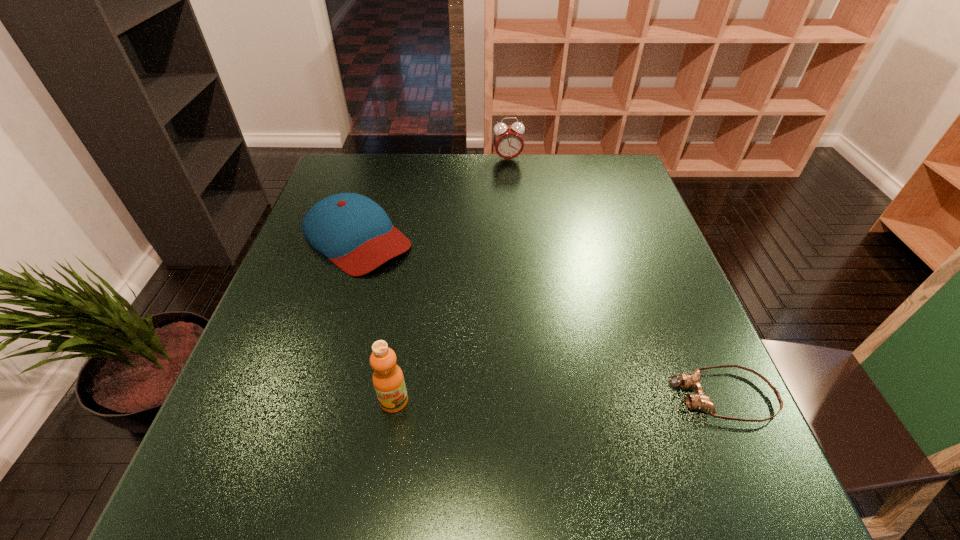
In order to click on vacant area located 0.380m on the clock face of the farthest object in this screenshot , I will do `click(530, 241)`.

Find the location of `vacant area located on the clock face of the farthest object`. vacant area located on the clock face of the farthest object is located at coordinates (520, 202).

In order to click on free space located 0.060m on the clock face of the farthest object in this screenshot , I will do `click(513, 174)`.

Find the location of a particular element. This screenshot has height=540, width=960. free space located 0.250m with the bill of the second farthest object facing forward is located at coordinates (460, 325).

Locate an element on the screen. The height and width of the screenshot is (540, 960). free region located with the bill of the second farthest object facing forward is located at coordinates (419, 290).

You are a GUI agent. You are given a task and a screenshot of the screen. Output one action in this format:
    pyautogui.click(x=<x>, y=<y>)
    Task: Click on the free space located with the bill of the second farthest object facing forward
    The image size is (960, 540).
    Given the screenshot: What is the action you would take?
    pyautogui.click(x=486, y=347)

The height and width of the screenshot is (540, 960). Find the location of `object that is at the far edge`. object that is at the far edge is located at coordinates (508, 141).

This screenshot has height=540, width=960. Identify the location of orange juice at the near edge. (388, 380).

Locate an element on the screen. goggles that is at the near edge is located at coordinates (700, 401).

Where is `object located in the left edge section of the desktop`? object located in the left edge section of the desktop is located at coordinates (354, 232).